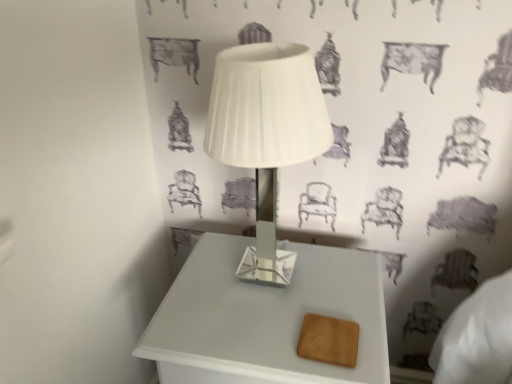
Question: Is white glossy table at center surrounded by white glossy lamp at center?

Choices:
 (A) yes
 (B) no

Answer: (B)

Question: Is white glossy lamp at center next to white glossy table at center and touching it?

Choices:
 (A) no
 (B) yes

Answer: (A)

Question: From a real-world perspective, is white glossy lamp at center physically above white glossy table at center?

Choices:
 (A) yes
 (B) no

Answer: (A)

Question: From the image's perspective, would you say white glossy lamp at center is shown under white glossy table at center?

Choices:
 (A) yes
 (B) no

Answer: (B)

Question: Is white glossy lamp at center bigger than white glossy table at center?

Choices:
 (A) no
 (B) yes

Answer: (A)

Question: From a real-world perspective, is white glossy lamp at center physically below white glossy table at center?

Choices:
 (A) no
 (B) yes

Answer: (A)

Question: Is white glossy table at center next to white glossy lamp at center and touching it?

Choices:
 (A) no
 (B) yes

Answer: (A)

Question: From a real-world perspective, is white glossy table at center physically below white glossy lamp at center?

Choices:
 (A) no
 (B) yes

Answer: (B)

Question: Is white glossy table at center further to the viewer compared to white glossy lamp at center?

Choices:
 (A) no
 (B) yes

Answer: (B)

Question: Is white glossy table at center far away from white glossy lamp at center?

Choices:
 (A) yes
 (B) no

Answer: (B)

Question: Can you confirm if white glossy table at center is positioned to the left of white glossy lamp at center?

Choices:
 (A) yes
 (B) no

Answer: (B)

Question: Is white glossy table at center positioned with its back to white glossy lamp at center?

Choices:
 (A) no
 (B) yes

Answer: (A)

Question: Is point (246, 46) positioned closer to the camera than point (227, 311)?

Choices:
 (A) closer
 (B) farther

Answer: (A)